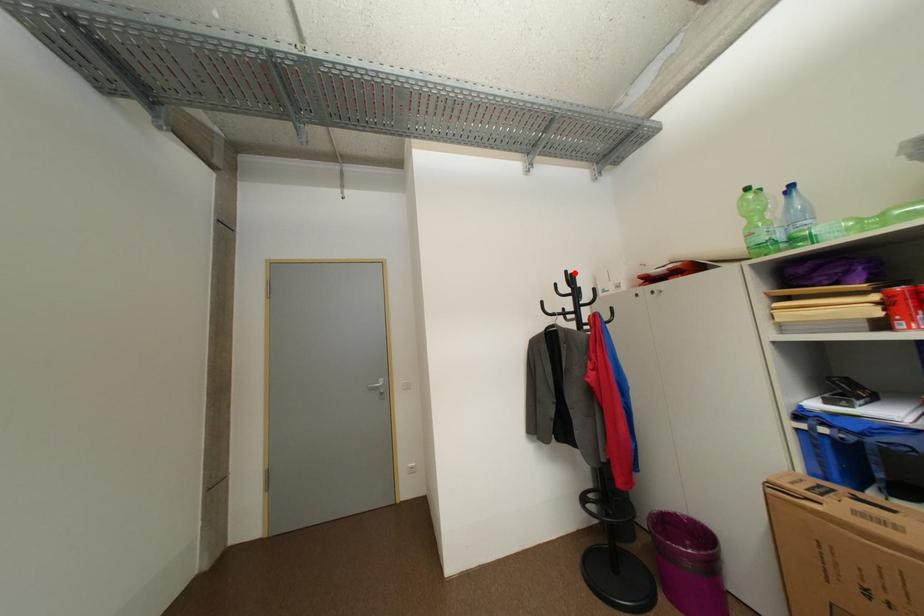
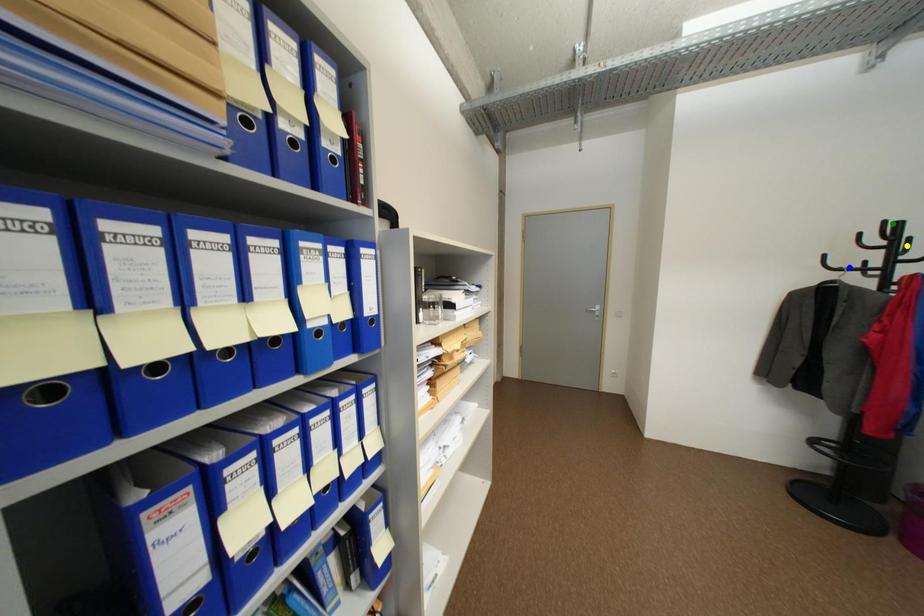
Question: I am providing you with two images of the same scene from different viewpoints. A red point is marked on the first image. You are given multiple points on the second image. Which point in image 2 is actually the same real-world point as the red point in image 1?

Choices:
 (A) yellow point
 (B) green point
 (C) blue point

Answer: (B)